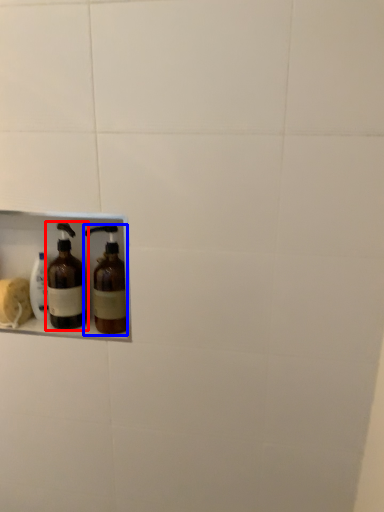
Question: Which point is further to the camera, bottle (highlighted by a red box) or bottle (highlighted by a blue box)?

Choices:
 (A) bottle
 (B) bottle

Answer: (A)